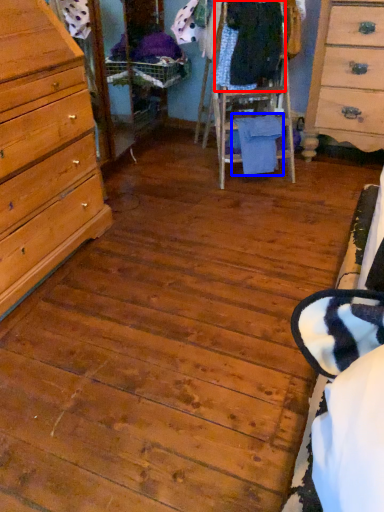
Question: Which object is closer to the camera taking this photo, clothing (highlighted by a red box) or clothing (highlighted by a blue box)?

Choices:
 (A) clothing
 (B) clothing

Answer: (A)